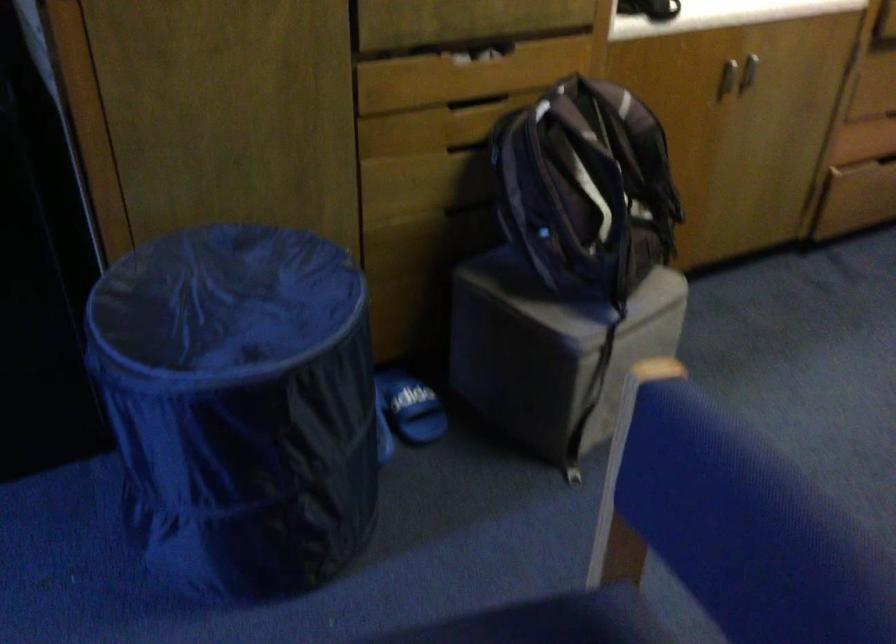
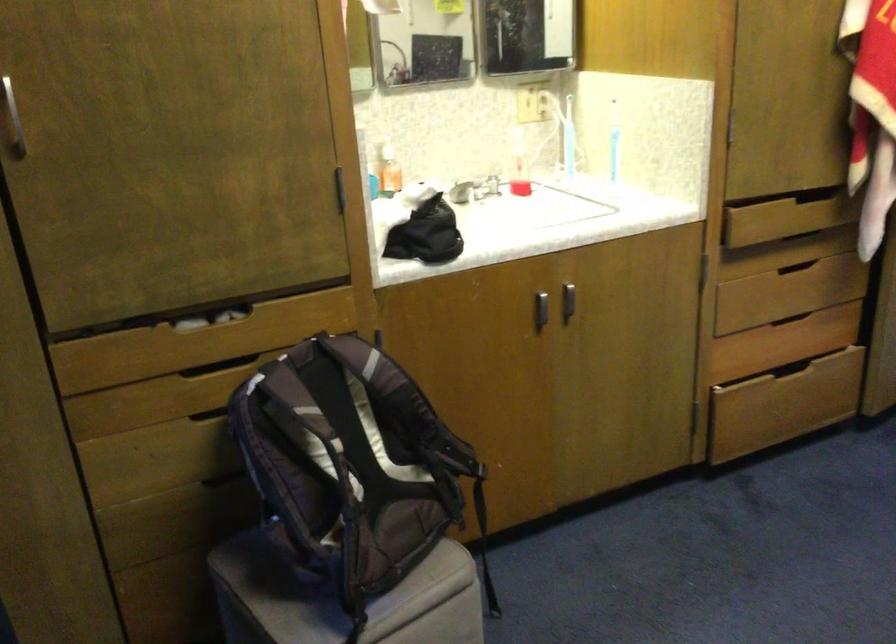
Question: Which direction would the cameraman need to move to produce the second image? Reply with the corresponding letter.

Choices:
 (A) Left
 (B) Right
 (C) Forward
 (D) Backward

Answer: (B)